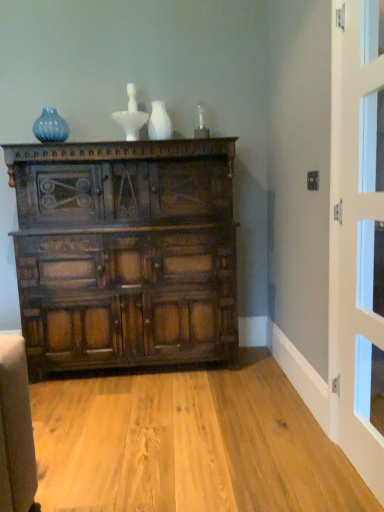
Locate an element on the screen. This screenshot has width=384, height=512. blank space above matte blue glass vase at upper left, which is the second vase in right-to-left order (from a real-world perspective) is located at coordinates (41, 110).